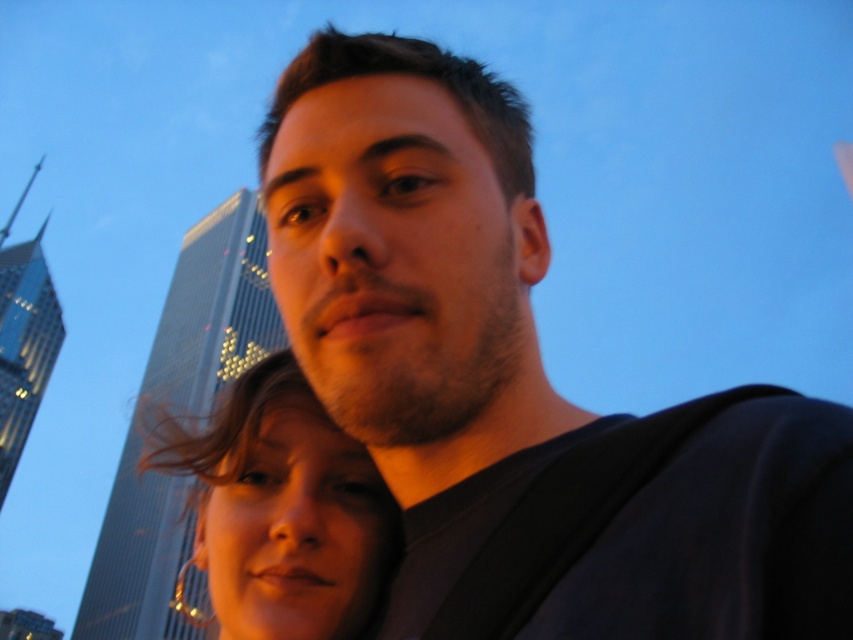
Question: Is matte black shirt at center to the right of matte gold hoop earrings at lower left from the viewer's perspective?

Choices:
 (A) yes
 (B) no

Answer: (A)

Question: Among these objects, which one is nearest to the camera?

Choices:
 (A) matte gold hoop earrings at lower left
 (B) matte black shirt at center

Answer: (B)

Question: Which point appears closest to the camera in this image?

Choices:
 (A) 469,284
 (B) 289,621

Answer: (B)

Question: Which point appears farthest from the camera in this image?

Choices:
 (A) (798, 577)
 (B) (241, 608)

Answer: (B)

Question: Can you confirm if matte black shirt at center is positioned to the left of matte gold hoop earrings at lower left?

Choices:
 (A) no
 (B) yes

Answer: (A)

Question: Is matte black shirt at center to the right of matte gold hoop earrings at lower left from the viewer's perspective?

Choices:
 (A) yes
 (B) no

Answer: (A)